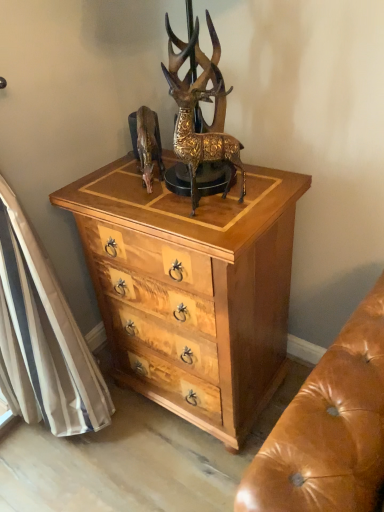
Question: Does gold textured deer at center have a smaller size compared to shiny brown deer at center?

Choices:
 (A) yes
 (B) no

Answer: (B)

Question: From a real-world perspective, does gold textured deer at center stand above shiny brown deer at center?

Choices:
 (A) no
 (B) yes

Answer: (B)

Question: Is gold textured deer at center positioned far away from shiny brown deer at center?

Choices:
 (A) no
 (B) yes

Answer: (A)

Question: Is gold textured deer at center aimed at shiny brown deer at center?

Choices:
 (A) yes
 (B) no

Answer: (B)

Question: From the image's perspective, does gold textured deer at center appear lower than shiny brown deer at center?

Choices:
 (A) yes
 (B) no

Answer: (A)

Question: Is gold textured deer at center directly adjacent to shiny brown deer at center?

Choices:
 (A) no
 (B) yes

Answer: (A)

Question: Is shiny brown deer at center closer to the viewer compared to gold textured deer at center?

Choices:
 (A) no
 (B) yes

Answer: (A)

Question: Can you confirm if shiny brown deer at center is taller than gold textured deer at center?

Choices:
 (A) no
 (B) yes

Answer: (A)

Question: From a real-world perspective, does shiny brown deer at center sit lower than gold textured deer at center?

Choices:
 (A) yes
 (B) no

Answer: (A)

Question: Is shiny brown deer at center not close to gold textured deer at center?

Choices:
 (A) no
 (B) yes

Answer: (A)

Question: Is shiny brown deer at center facing away from gold textured deer at center?

Choices:
 (A) no
 (B) yes

Answer: (A)

Question: Is the position of shiny brown deer at center more distant than that of gold textured deer at center?

Choices:
 (A) yes
 (B) no

Answer: (A)

Question: Could you tell me if light wood/texture chest of drawers at center is turned towards shiny brown deer at center?

Choices:
 (A) yes
 (B) no

Answer: (B)